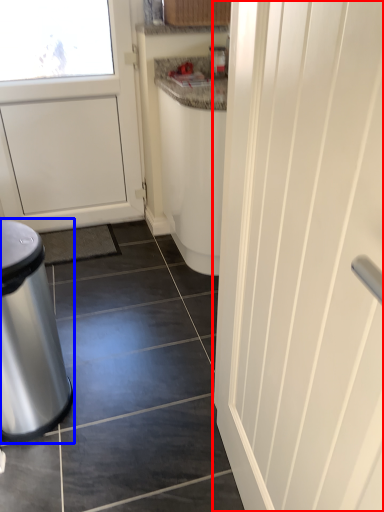
Question: Among these objects, which one is nearest to the camera, door (highlighted by a red box) or waste container (highlighted by a blue box)?

Choices:
 (A) door
 (B) waste container

Answer: (A)